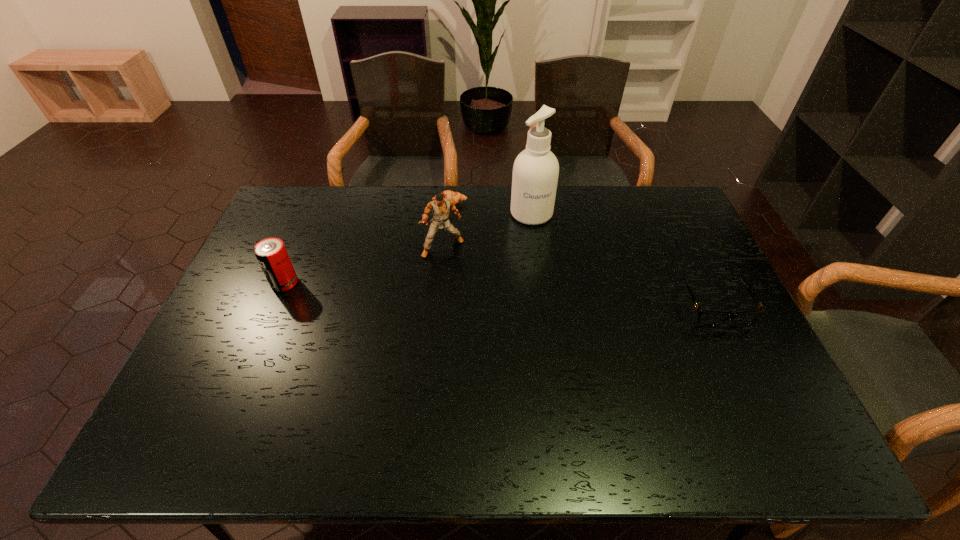
Image resolution: width=960 pixels, height=540 pixels. In order to click on pastry located at the far edge in this screenshot , I will do `click(456, 197)`.

Locate an element on the screen. The height and width of the screenshot is (540, 960). cleansing agent that is at the far edge is located at coordinates click(535, 175).

This screenshot has width=960, height=540. I want to click on object positioned at the left edge, so click(271, 253).

Identify the location of object situated at the right edge. The height and width of the screenshot is (540, 960). (710, 318).

You are a GUI agent. You are given a task and a screenshot of the screen. Output one action in this format:
    pyautogui.click(x=<x>, y=<y>)
    Task: Click on the vacant space at the far edge of the desktop
    Image resolution: width=960 pixels, height=540 pixels.
    Given the screenshot: What is the action you would take?
    pyautogui.click(x=600, y=212)

In the image, there is a desktop. In order to click on vacant space at the near edge in this screenshot , I will do `click(636, 377)`.

You are a GUI agent. You are given a task and a screenshot of the screen. Output one action in this format:
    pyautogui.click(x=<x>, y=<y>)
    Task: Click on the vacant space at the left edge
    The image size is (960, 540).
    Given the screenshot: What is the action you would take?
    pyautogui.click(x=295, y=227)

In the image, there is a desktop. Where is `vacant space at the right edge`? The width and height of the screenshot is (960, 540). vacant space at the right edge is located at coordinates (670, 276).

In the image, there is a desktop. Where is `vacant space at the far right corner`? The height and width of the screenshot is (540, 960). vacant space at the far right corner is located at coordinates coord(660,199).

Where is `free spot between the sunglasses and the cleansing agent`? Image resolution: width=960 pixels, height=540 pixels. free spot between the sunglasses and the cleansing agent is located at coordinates (623, 260).